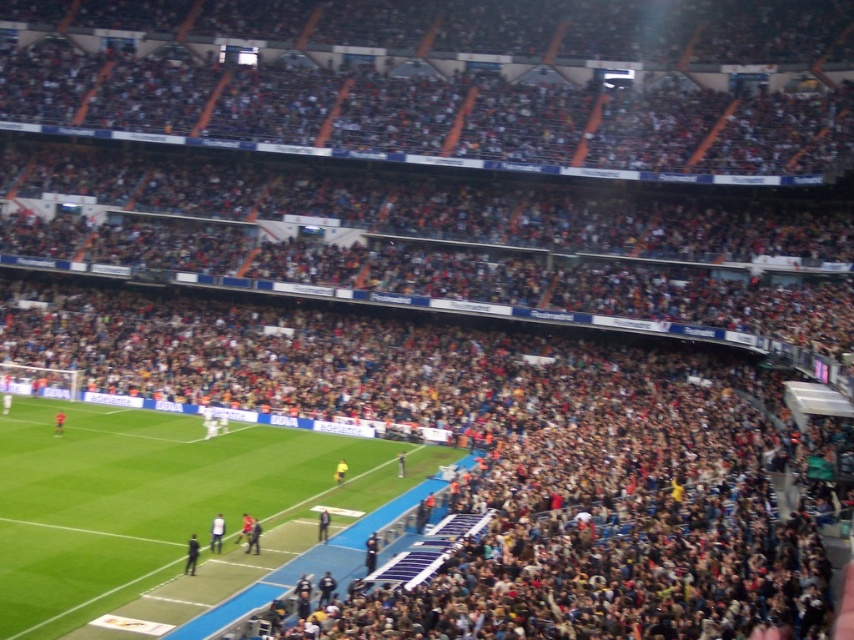
Which of these two, green grass at center or dark blue uniform at center, stands taller?

green grass at center is taller.

Who is more forward, (6,509) or (256,529)?

Point (256,529)

Locate an element on the screen. green grass at center is located at coordinates (154, 499).

Can you confirm if green grass at center is positioned above yellow jersey at center?

Yes.

Is green grass at center smaller than yellow jersey at center?

No.

Does point (352, 449) come behind point (241, 531)?

Yes.

Identify the location of green grass at center. Image resolution: width=854 pixels, height=640 pixels. (154, 499).

Which is more to the left, dark blue uniform at center or yellow jersey at center?

yellow jersey at center

Is dark blue uniform at center wider than yellow jersey at center?

Indeed, dark blue uniform at center has a greater width compared to yellow jersey at center.

This screenshot has width=854, height=640. What do you see at coordinates (253, 536) in the screenshot?
I see `dark blue uniform at center` at bounding box center [253, 536].

Locate an element on the screen. This screenshot has height=640, width=854. dark blue uniform at center is located at coordinates (253, 536).